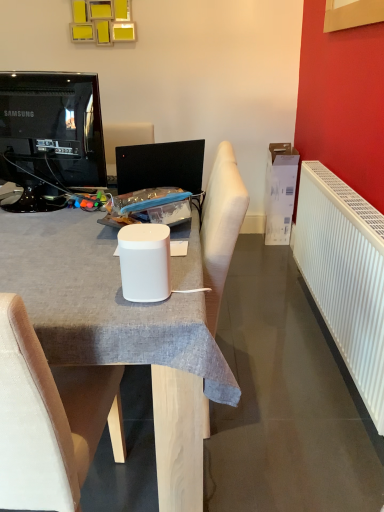
What are the coordinates of `unoccupied area in front of white matte speaker at center` in the screenshot? It's located at (137, 316).